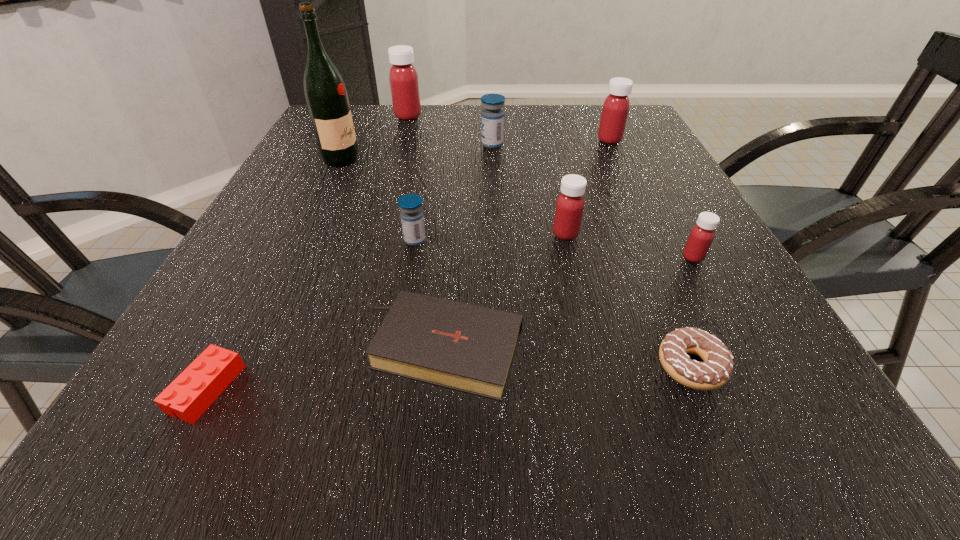
Identify the location of vacant region located on the left of the right blue medicine. (329, 145).

Find the location of a particular element. The image size is (960, 540). free location located 0.070m on the right of the third farthest red medicine is located at coordinates (614, 234).

Identify the location of vacant space located 0.290m on the left of the left blue medicine. (252, 240).

Identify the location of blank space located on the front of the nearest medicine. (726, 318).

The height and width of the screenshot is (540, 960). What are the coordinates of `vacant region located 0.190m on the right of the Bible` in the screenshot? It's located at (651, 349).

The width and height of the screenshot is (960, 540). What are the coordinates of `vacant space situated 0.390m on the back of the chocolate doughnut` in the screenshot? It's located at (620, 198).

The height and width of the screenshot is (540, 960). Find the location of `free space located on the right of the red Lego`. free space located on the right of the red Lego is located at coordinates (424, 389).

Where is `Bible that is at the near edge`? Bible that is at the near edge is located at coordinates (468, 348).

Locate an element on the screen. This screenshot has height=540, width=960. Lego present at the near edge is located at coordinates (199, 385).

Where is `liquor present at the left edge`? The height and width of the screenshot is (540, 960). liquor present at the left edge is located at coordinates (326, 95).